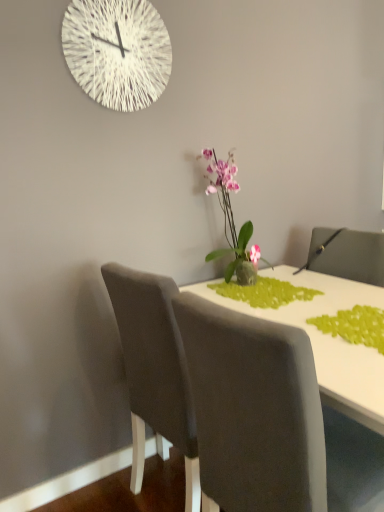
Image resolution: width=384 pixels, height=512 pixels. Find the location of `vacant space to the right of green matte plant at center, acting as the second plant starting from the front`. vacant space to the right of green matte plant at center, acting as the second plant starting from the front is located at coordinates (350, 294).